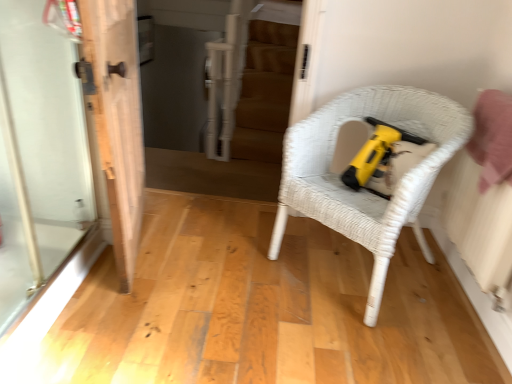
Question: Can you confirm if transparent glass screen door at left is smaller than white wood door at left?

Choices:
 (A) no
 (B) yes

Answer: (B)

Question: From a real-world perspective, is transparent glass screen door at left positioned over white wood door at left based on gravity?

Choices:
 (A) no
 (B) yes

Answer: (B)

Question: Is transparent glass screen door at left wider than white wood door at left?

Choices:
 (A) no
 (B) yes

Answer: (A)

Question: Does transparent glass screen door at left have a lesser height compared to white wood door at left?

Choices:
 (A) yes
 (B) no

Answer: (A)

Question: Does transparent glass screen door at left come behind white wood door at left?

Choices:
 (A) yes
 (B) no

Answer: (B)

Question: Does transparent glass screen door at left have a larger size compared to white wood door at left?

Choices:
 (A) yes
 (B) no

Answer: (B)

Question: Is white wood door at left taller than transparent glass screen door at left?

Choices:
 (A) yes
 (B) no

Answer: (A)

Question: Does white wood door at left have a lesser height compared to transparent glass screen door at left?

Choices:
 (A) yes
 (B) no

Answer: (B)

Question: Is white wood door at left bigger than transparent glass screen door at left?

Choices:
 (A) no
 (B) yes

Answer: (B)

Question: Can you confirm if white wood door at left is smaller than transparent glass screen door at left?

Choices:
 (A) yes
 (B) no

Answer: (B)

Question: Is the depth of white wood door at left greater than that of transparent glass screen door at left?

Choices:
 (A) yes
 (B) no

Answer: (A)

Question: Can you confirm if white wood door at left is wider than transparent glass screen door at left?

Choices:
 (A) no
 (B) yes

Answer: (B)

Question: Can you confirm if white wood door at left is wider than white wicker chair at center?

Choices:
 (A) yes
 (B) no

Answer: (B)